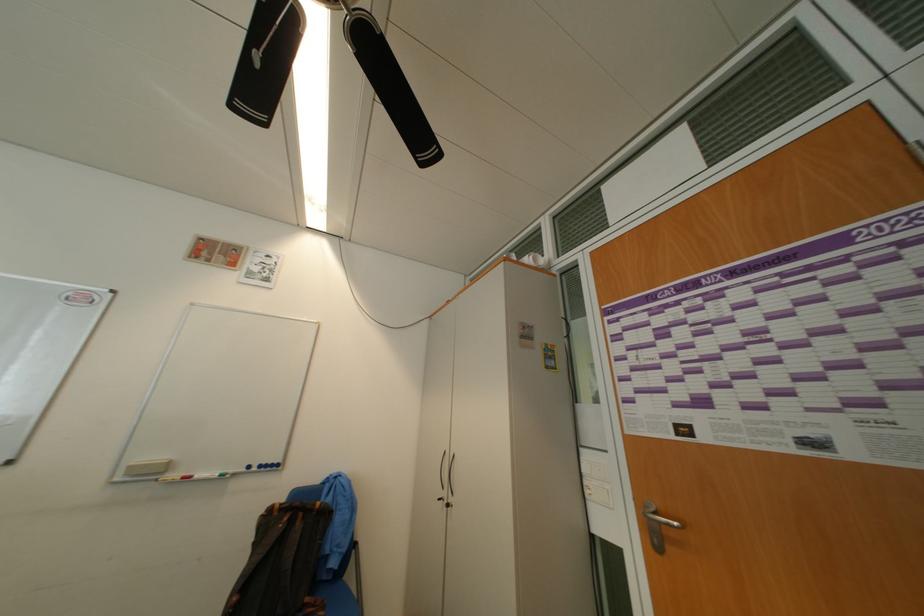
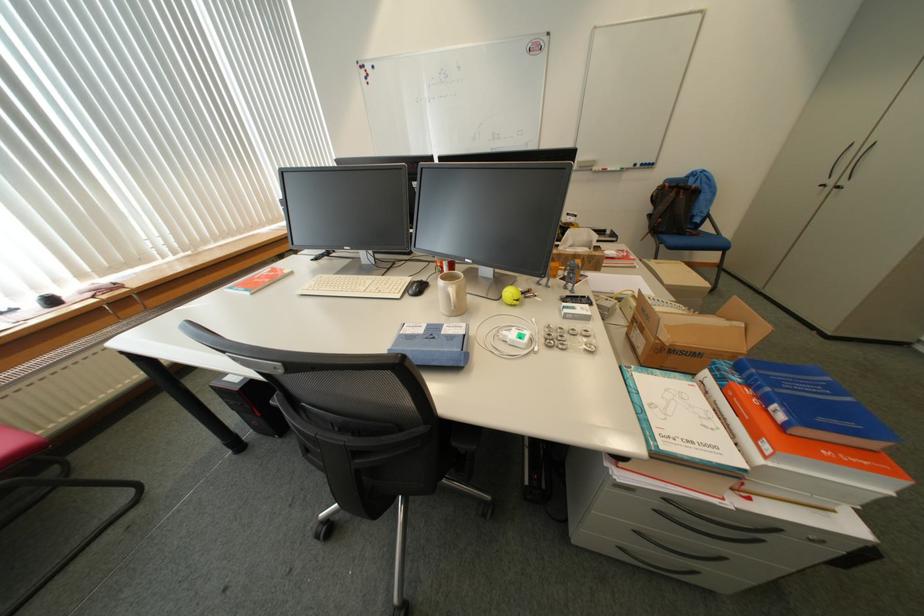
In the second image, find the point that corresponds to point (300, 523) in the first image.

(687, 195)